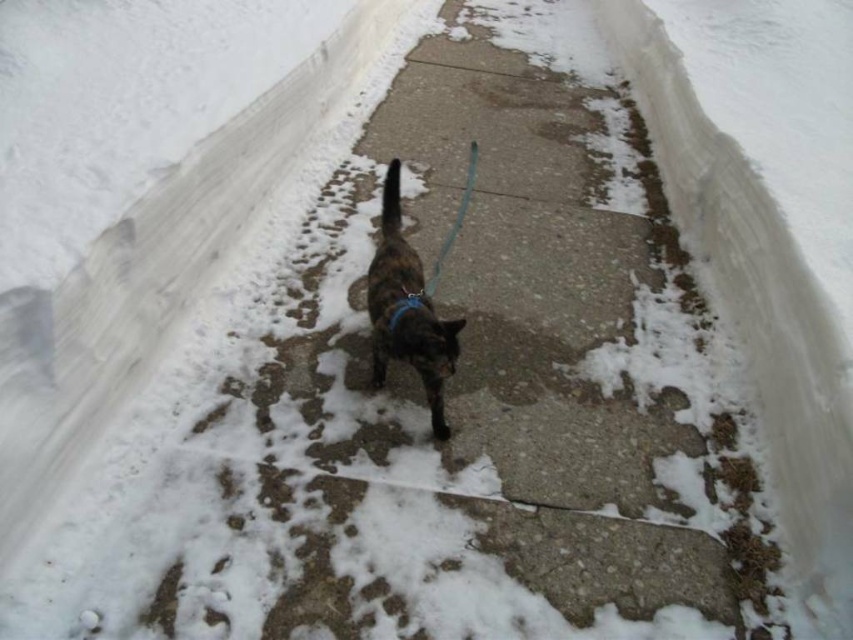
You are a photographer trying to capture the cat and its leash in the snowy path. According to the scene, is the brown fur cat at center positioned to the left or right of the teal fabric leash at center?

The brown fur cat at center is positioned to the left of the teal fabric leash at center.

You are a photographer trying to capture the brown fur cat at center and the teal fabric leash at center in a single shot. Based on their sizes, which one will appear more prominent in the photo?

The brown fur cat at center is bigger than the teal fabric leash at center, so it will appear more prominent in the photo.